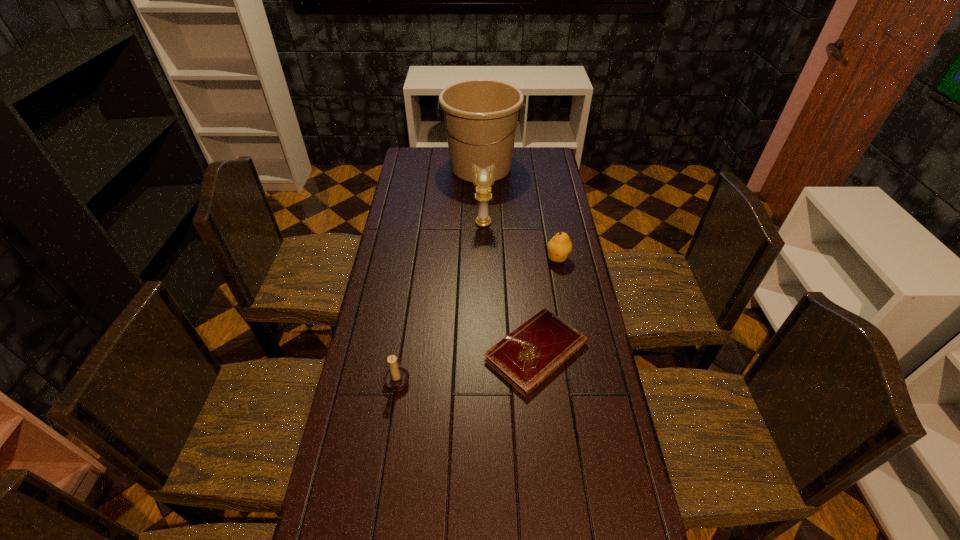
This screenshot has height=540, width=960. What are the coordinates of `the tallest object` in the screenshot? It's located at (481, 115).

You are a GUI agent. You are given a task and a screenshot of the screen. Output one action in this format:
    pyautogui.click(x=<x>, y=<y>)
    Task: Click on the farthest object
    The height and width of the screenshot is (540, 960).
    Given the screenshot: What is the action you would take?
    pyautogui.click(x=481, y=115)

The height and width of the screenshot is (540, 960). What are the coordinates of `award` in the screenshot? It's located at [483, 179].

Image resolution: width=960 pixels, height=540 pixels. I want to click on the second farthest object, so click(483, 179).

Identify the location of the leftmost object. The height and width of the screenshot is (540, 960). (396, 378).

Where is `the third farthest object`? the third farthest object is located at coordinates (559, 247).

The height and width of the screenshot is (540, 960). Identify the location of notebook. (528, 355).

Locate an element on the screen. This screenshot has width=960, height=540. free spot located on the front of the bucket is located at coordinates (481, 199).

Locate an element on the screen. The width and height of the screenshot is (960, 540). free space located on the front-facing side of the second farthest object is located at coordinates (484, 291).

In order to click on free location located on the wick of the leftmost object in this screenshot , I will do `click(453, 379)`.